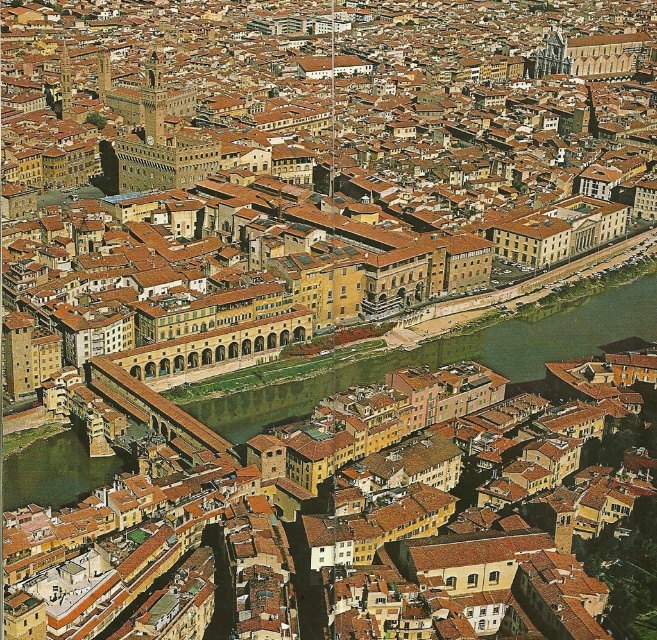
You are a city planner analyzing the layout of this historic area. Given the presence of the matte yellow building at center and the matte stone bridge at center, which of these two structures occupies a larger horizontal space in the image?

The matte yellow building at center has a greater width than the matte stone bridge at center, so it occupies a larger horizontal space in the image.

You are a tourist standing on the matte stone bridge at center. Looking down, you notice the green water at center flowing beneath you. Which direction is the water flowing relative to the bridge?

The green water at center is above the matte stone bridge at center, so the water is flowing over the bridge from above, meaning it flows in the same direction as the bridge but above it.

Consider the image. You are a city planner analyzing the layout of this historic area. You need to determine if there is enough space between the matte yellow building at center and the green water at center to install a new pedestrian walkway. Can you confirm if the building is wider than the water body?

The matte yellow building at center has a width larger than the green water at center, so yes, the building is wider than the water body, providing sufficient space for the new pedestrian walkway.